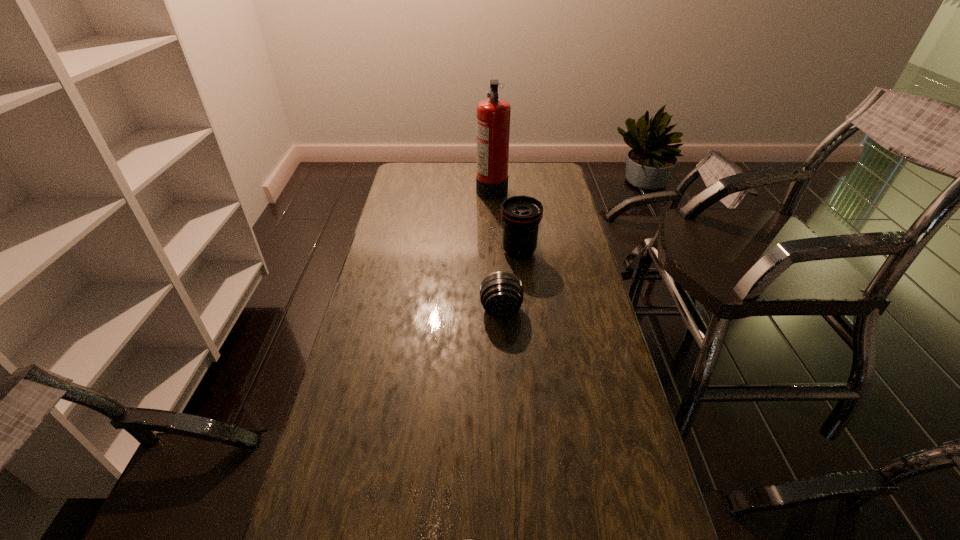
I want to click on free spot located at the front element of the second tallest telephoto lens, so click(506, 403).

Where is `object that is at the far edge`? The height and width of the screenshot is (540, 960). object that is at the far edge is located at coordinates (493, 115).

Identify the location of blank space at the far edge of the desktop. The width and height of the screenshot is (960, 540). (460, 185).

Locate an element on the screen. The height and width of the screenshot is (540, 960). free space at the left edge of the desktop is located at coordinates (374, 269).

The width and height of the screenshot is (960, 540). In the image, there is a desktop. Find the location of `free space at the right edge`. free space at the right edge is located at coordinates (607, 468).

I want to click on vacant space at the far right corner, so (549, 176).

Locate an element on the screen. vacant space that's between the second shortest telephoto lens and the farthest object is located at coordinates (496, 249).

What are the coordinates of `object that is the closest one to the tallest telephoto lens` in the screenshot? It's located at (501, 293).

Image resolution: width=960 pixels, height=540 pixels. Identify the location of object that is the nearest to the shortest object. (501, 293).

The height and width of the screenshot is (540, 960). Identify the location of telephoto lens that is the closest to the nearest telephoto lens. (501, 293).